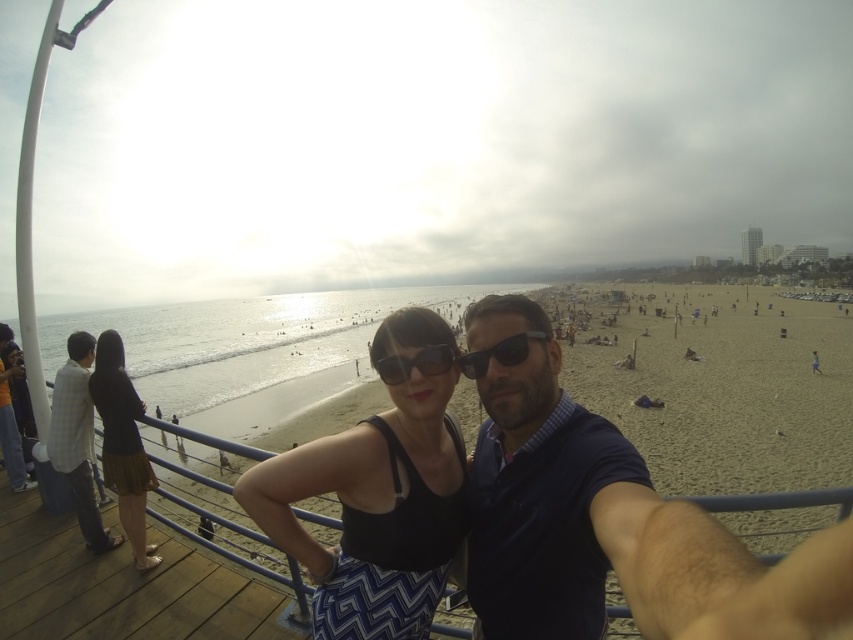
Question: Among these objects, which one is nearest to the camera?

Choices:
 (A) matte black sunglasses at center
 (B) dark blue polo shirt at center

Answer: (B)

Question: Which of the following is the closest to the observer?

Choices:
 (A) (537, 332)
 (B) (74, 502)

Answer: (A)

Question: Which of the following is the farthest from the observer?

Choices:
 (A) beige sand beach at center
 (B) black plastic sunglasses at center
 (C) black matte tank top at center
 (D) plaid fabric shirt at left

Answer: (D)

Question: Considering the relative positions of beige sand beach at center and matte black sunglasses at center in the image provided, where is beige sand beach at center located with respect to matte black sunglasses at center?

Choices:
 (A) left
 (B) right

Answer: (A)

Question: Does beige sand beach at center appear on the right side of brown skirt at lower left?

Choices:
 (A) no
 (B) yes

Answer: (A)

Question: In this image, where is black matte tank top at center located relative to matte black sunglasses at center?

Choices:
 (A) left
 (B) right

Answer: (A)